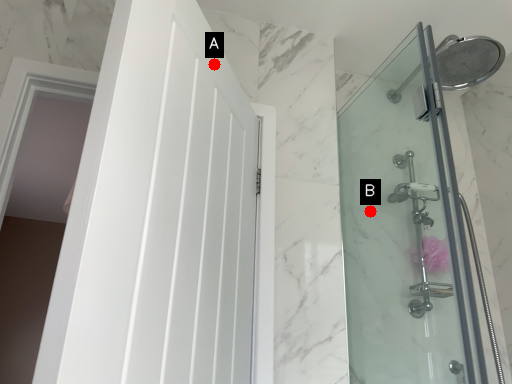
Question: Two points are circled on the image, labeled by A and B beside each circle. Which point is farther from the camera taking this photo?

Choices:
 (A) A is further
 (B) B is further

Answer: (B)